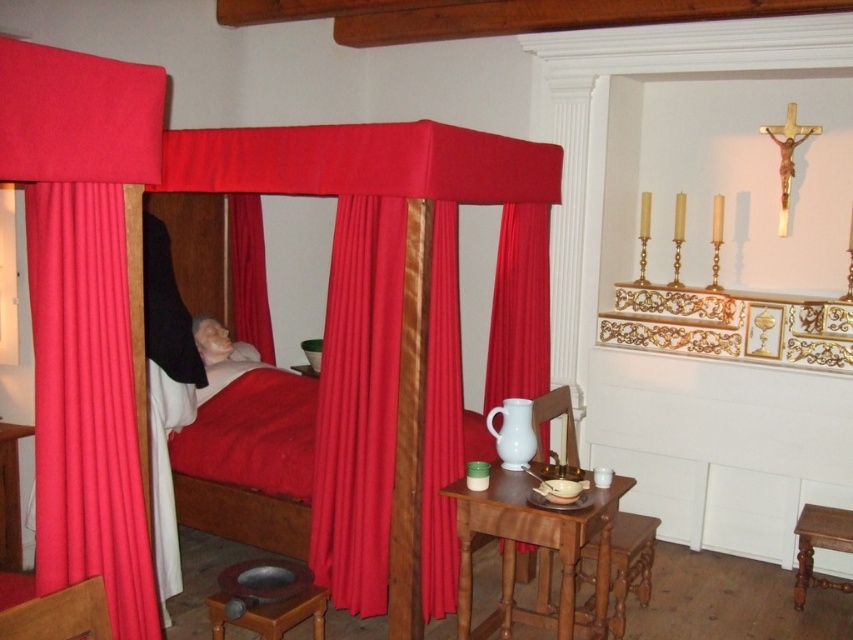
Is point (234, 166) in front of point (608, 513)?

No, (234, 166) is behind (608, 513).

Is point (526, 195) more distant than point (556, 632)?

Yes, point (526, 195) is farther from viewer.

Is point (370, 128) farther from viewer compared to point (575, 529)?

Yes, point (370, 128) is behind point (575, 529).

The width and height of the screenshot is (853, 640). I want to click on matte red fabric canopy bed at center, so click(x=393, y=312).

Is point (427, 483) farther from camera compared to point (631, 570)?

No, it is in front of (631, 570).

Which is behind, point (335, 264) or point (624, 540)?

The point (624, 540) is behind.

Find the location of `velvet red curtain at center`. velvet red curtain at center is located at coordinates (358, 403).

Between wooden stool at lower left and wooden carved stool at lower center, which one appears on the left side from the viewer's perspective?

Positioned to the left is wooden stool at lower left.

Can you confirm if wooden stool at lower left is bigger than wooden carved stool at lower center?

Incorrect, wooden stool at lower left is not larger than wooden carved stool at lower center.

Locate an element on the screen. wooden stool at lower left is located at coordinates (265, 596).